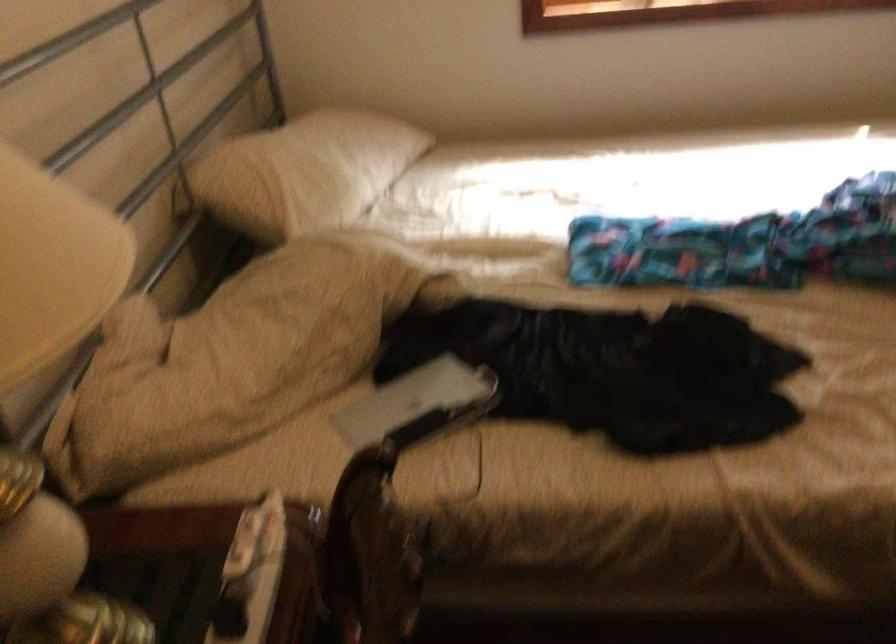
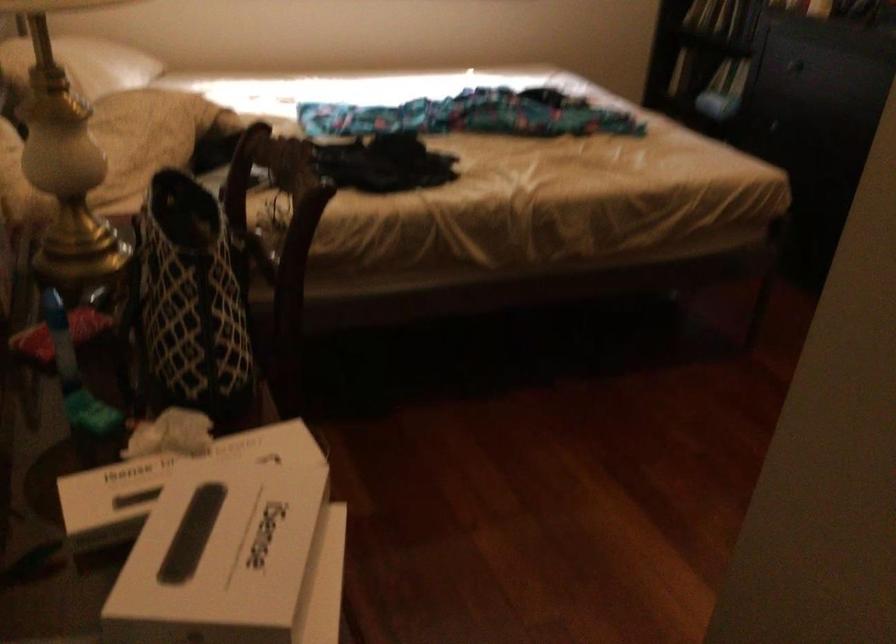
Looking at this image, in a continuous first-person perspective shot, in which direction is the camera moving?

The cameraman moved toward left, backward.